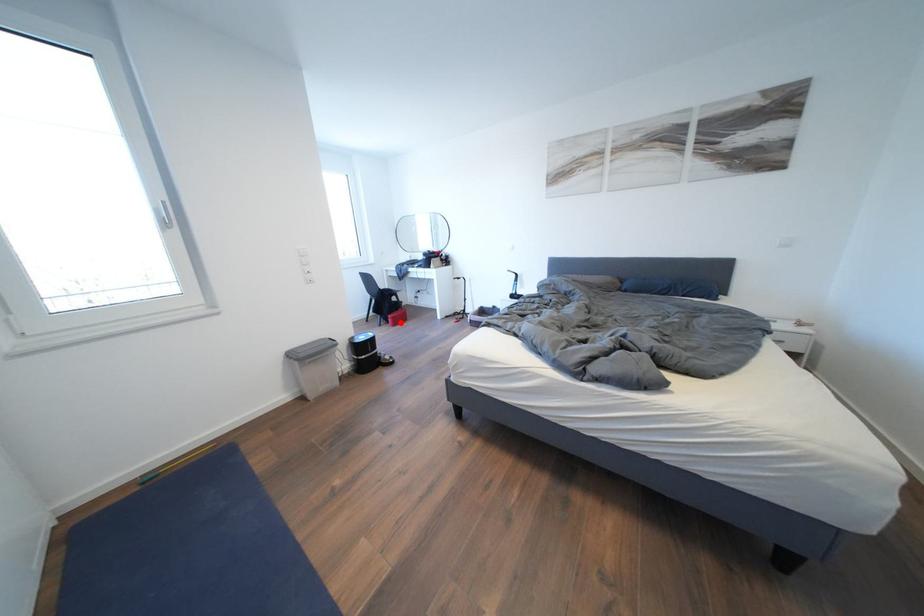
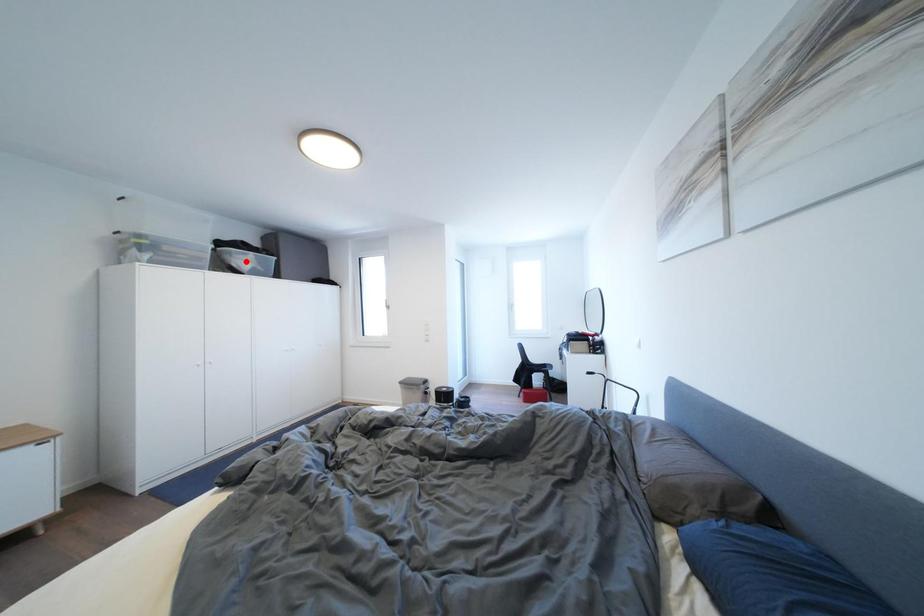
I am providing you with two images of the same scene from different viewpoints. A red point is marked on the first image and another point is marked on the second image. Are the points marked in image1 and image2 representing the same 3D position?

No